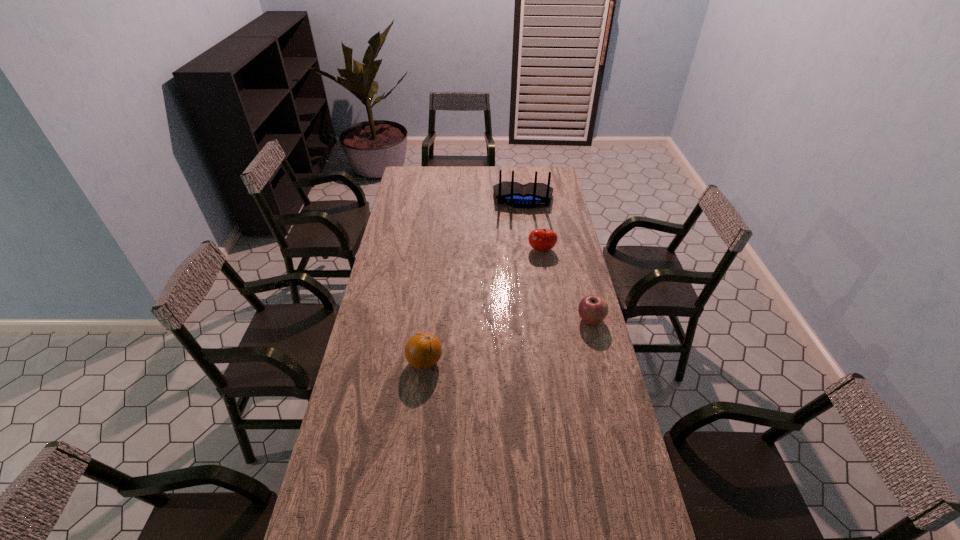
Find the location of a particular element. This screenshot has height=540, width=960. free space that is in between the second nearest object and the nearest object is located at coordinates (508, 341).

I want to click on object that is the closest to the nearer apple, so click(x=539, y=239).

Select which object is the third closest to the second farthest object. Please provide its 2D coordinates. Your answer should be formatted as a tuple, i.e. [(x, y)], where the tuple contains the x and y coordinates of a point satisfying the conditions above.

[(423, 350)]

Find the location of a particular element. This screenshot has width=960, height=540. vacant space that satisfies the following two spatial constraints: 1. on the back side of the nearer apple; 2. on the right side of the nearest object is located at coordinates (429, 320).

The height and width of the screenshot is (540, 960). In order to click on free point that satisfies the following two spatial constraints: 1. on the front side of the second farthest object; 2. on the right side of the nearer apple in this screenshot , I will do `click(553, 320)`.

I want to click on free space that satisfies the following two spatial constraints: 1. on the back side of the nearest object; 2. on the right side of the right apple, so click(x=429, y=320).

Find the location of a particular element. vacant area that satisfies the following two spatial constraints: 1. on the front side of the tallest object; 2. on the left side of the third farthest object is located at coordinates (540, 320).